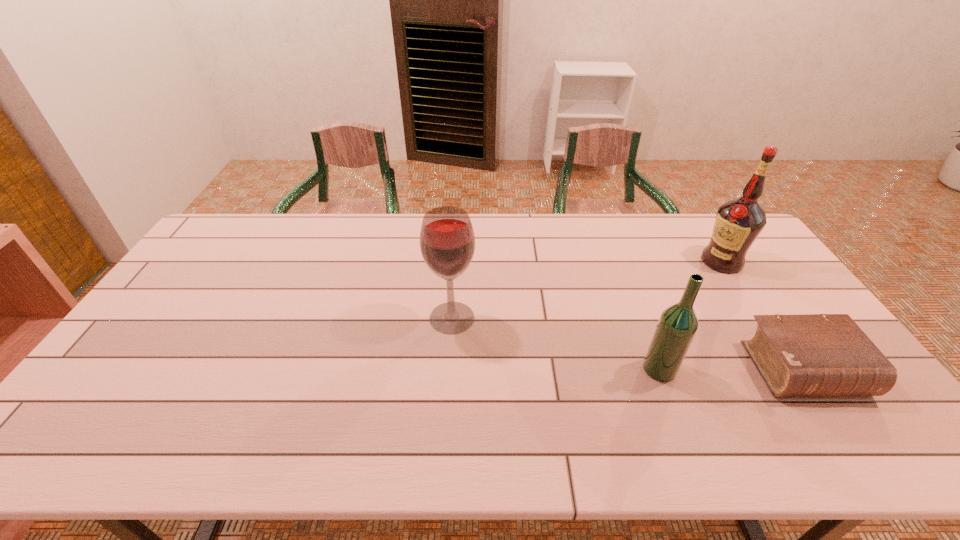
Where is `the farthest alcohol`? Image resolution: width=960 pixels, height=540 pixels. the farthest alcohol is located at coordinates (738, 223).

Locate an element on the screen. the rightmost alcohol is located at coordinates (738, 223).

At what (x,y) coordinates should I click in order to perform the action: click on the second farthest alcohol. Please return your answer as a coordinate pair (x, y). Looking at the image, I should click on (447, 241).

The width and height of the screenshot is (960, 540). I want to click on the leftmost object, so click(447, 241).

I want to click on the second alcohol from left to right, so click(676, 328).

I want to click on the third object from right to left, so click(x=676, y=328).

Locate an element on the screen. The image size is (960, 540). the shortest object is located at coordinates (813, 355).

I want to click on free space located 0.140m on the label of the tallest alcohol, so click(660, 261).

The image size is (960, 540). Find the location of `vacant area situated 0.260m on the label of the tallest alcohol`. vacant area situated 0.260m on the label of the tallest alcohol is located at coordinates (625, 261).

The image size is (960, 540). I want to click on free space located on the label of the tallest alcohol, so click(642, 261).